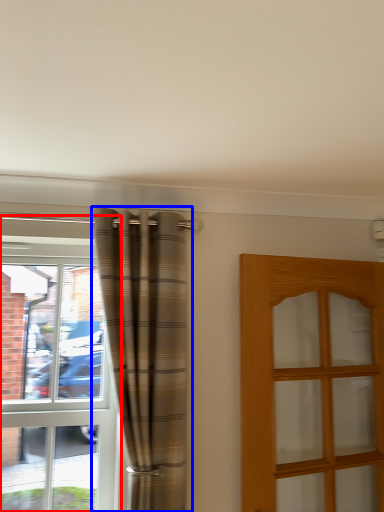
Question: Which point is closer to the camera, window (highlighted by a red box) or curtain (highlighted by a blue box)?

Choices:
 (A) window
 (B) curtain

Answer: (B)